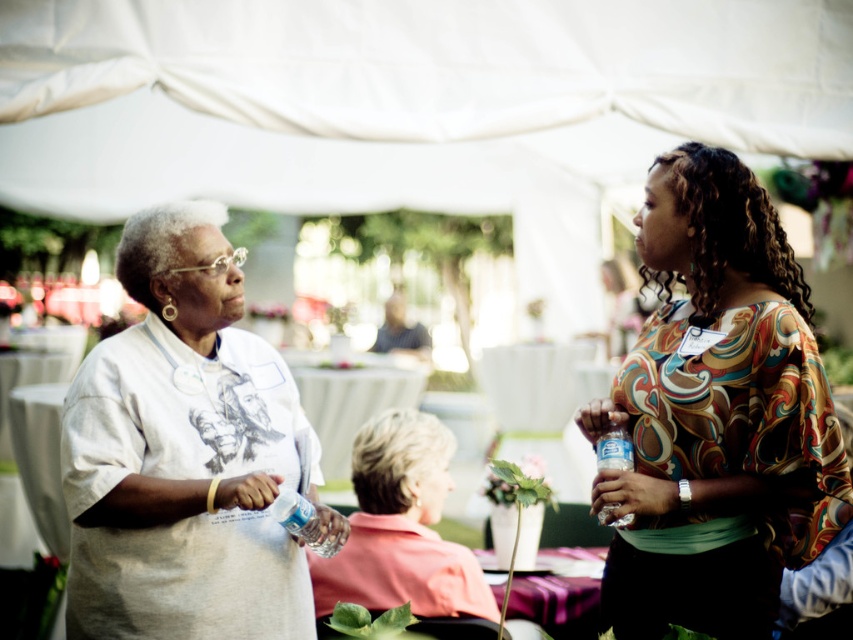
You are at an outdoor event and want to approach the person wearing the light gray cotton shirt at left. Which direction should you move relative to the matte floral blouse at center?

To reach the light gray cotton shirt at left, move to the left of the matte floral blouse at center since the light gray cotton shirt at left is positioned to the left of the matte floral blouse at center.

You are organizing a clothing donation drive and need to determine if the light gray cotton shirt at left can fit into a donation box that has a minimum width requirement of 15 cm. Given that the clear plastic bottle at center is 10 cm wide, can the shirt fit?

The light gray cotton shirt at left is wider than the clear plastic bottle at center, which is 10 cm wide. Therefore, the shirt should fit into the donation box with a minimum width requirement of 15 cm.

You are at an outdoor event and see the light gray cotton shirt at left and the clear plastic bottle at center. Which object is positioned to the left of the other?

The light gray cotton shirt at left is positioned to the left of the clear plastic bottle at center.